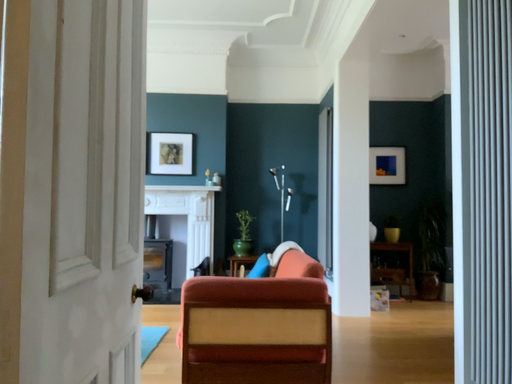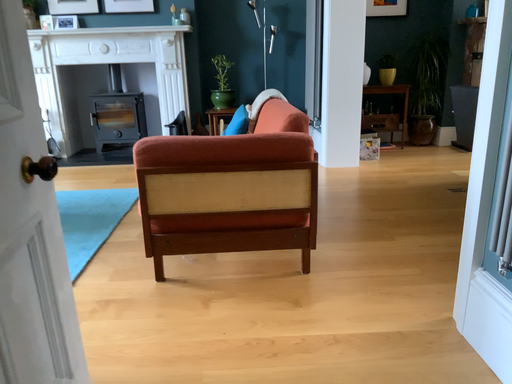
Question: How did the camera likely rotate when shooting the video?

Choices:
 (A) rotated upward
 (B) rotated downward

Answer: (B)